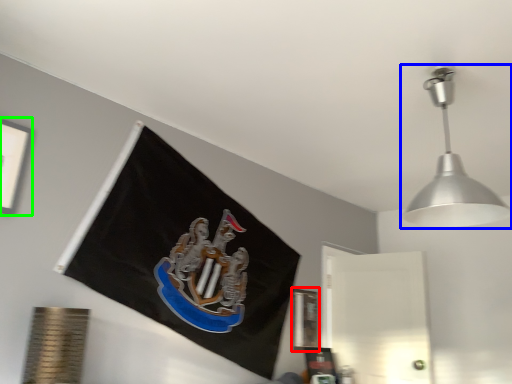
Question: Estimate the real-world distances between objects in this image. Which object is closer to picture frame (highlighted by a red box), lamp (highlighted by a blue box) or picture frame (highlighted by a green box)?

Choices:
 (A) lamp
 (B) picture frame

Answer: (A)